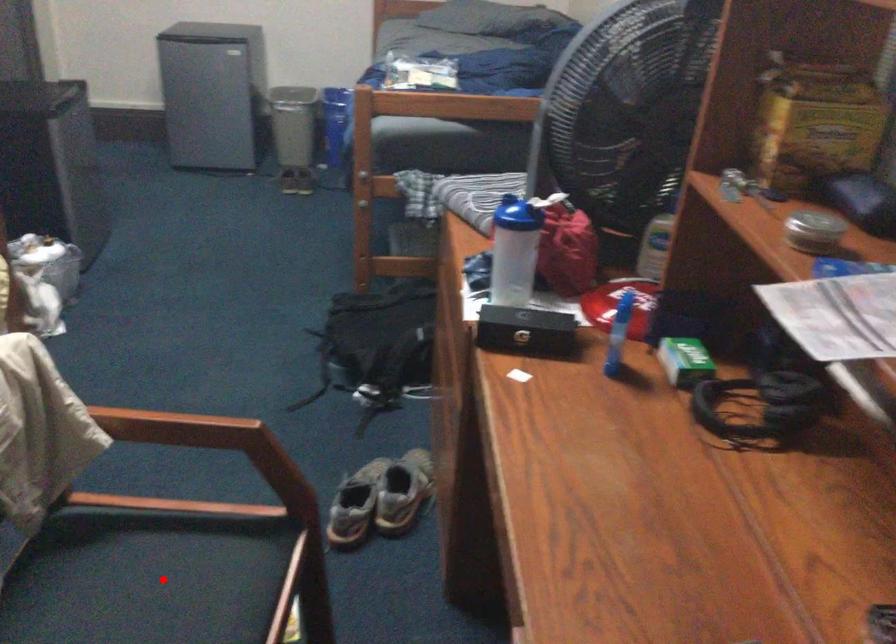
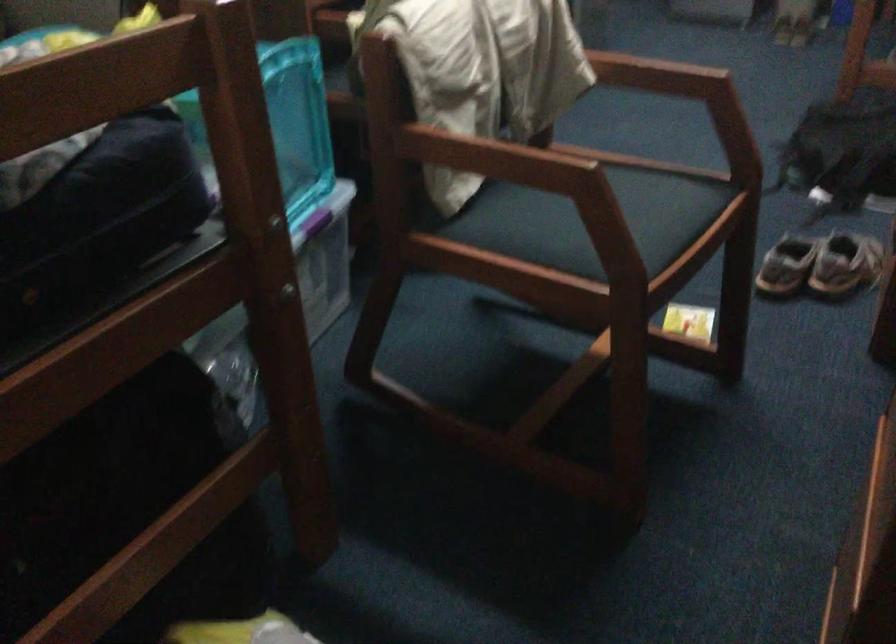
Question: I am providing you with two images of the same scene from different viewpoints. A red point is marked on the first image. At the location where the point appears in image 1, is it still visible in image 2?

Choices:
 (A) Yes
 (B) No

Answer: (B)